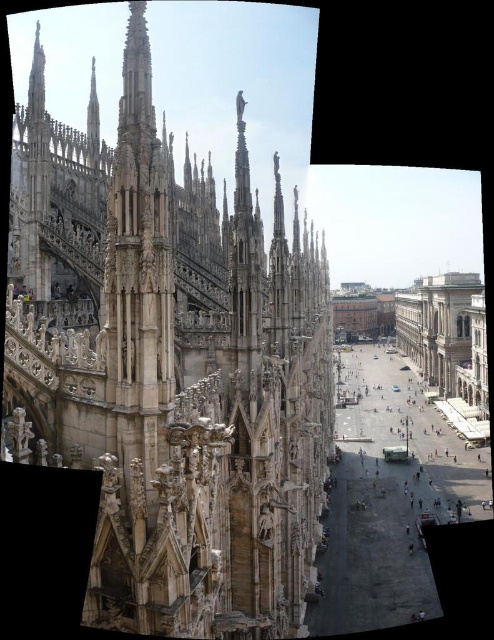
Can you confirm if stone gothic cathedral at center is positioned below beige stone building at right?

No, stone gothic cathedral at center is not below beige stone building at right.

Which of these two, stone gothic cathedral at center or beige stone building at right, stands taller?

With more height is stone gothic cathedral at center.

Who is more forward, (195,560) or (402,298)?

Point (195,560) is more forward.

This screenshot has width=494, height=640. Find the location of `stone gothic cathedral at center`. stone gothic cathedral at center is located at coordinates (171, 365).